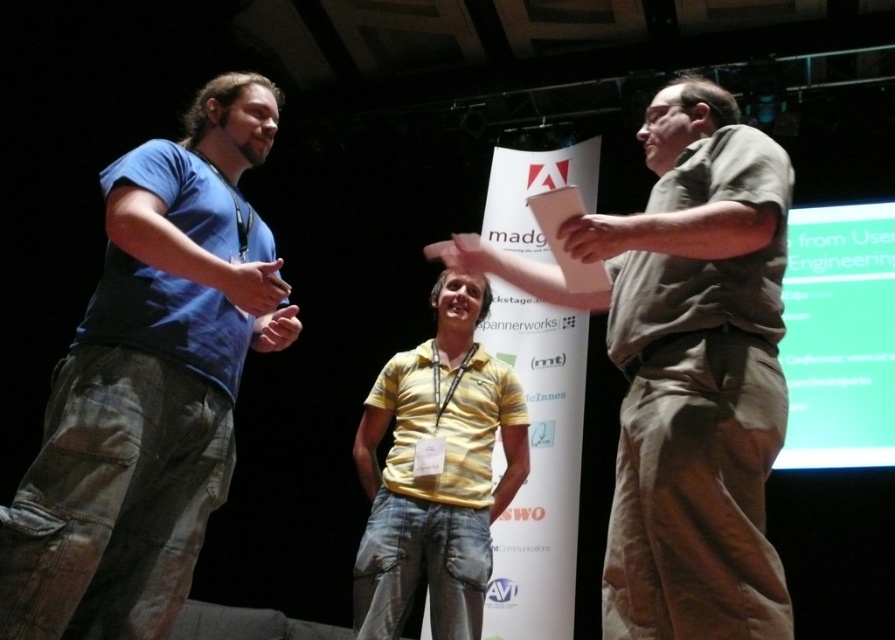
Question: Can you confirm if matte brown shirt at center is positioned below yellow matte shirt at center?

Choices:
 (A) yes
 (B) no

Answer: (B)

Question: Among these points, which one is nearest to the camera?

Choices:
 (A) (433, 388)
 (B) (683, 300)
 (C) (150, 240)

Answer: (B)

Question: Estimate the real-world distances between objects in this image. Which object is closer to the blue cotton shirt at left?

Choices:
 (A) yellow matte shirt at center
 (B) matte brown shirt at center

Answer: (B)

Question: Does matte brown shirt at center have a larger size compared to yellow matte shirt at center?

Choices:
 (A) no
 (B) yes

Answer: (A)

Question: Among these objects, which one is nearest to the camera?

Choices:
 (A) blue cotton shirt at left
 (B) matte brown shirt at center
 (C) yellow matte shirt at center

Answer: (B)

Question: Where is matte brown shirt at center located in relation to yellow matte shirt at center in the image?

Choices:
 (A) below
 (B) above

Answer: (B)